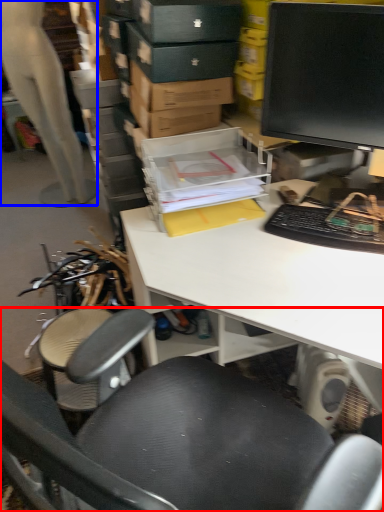
Question: Which point is closer to the camera, chair (highlighted by a red box) or person (highlighted by a blue box)?

Choices:
 (A) chair
 (B) person

Answer: (A)